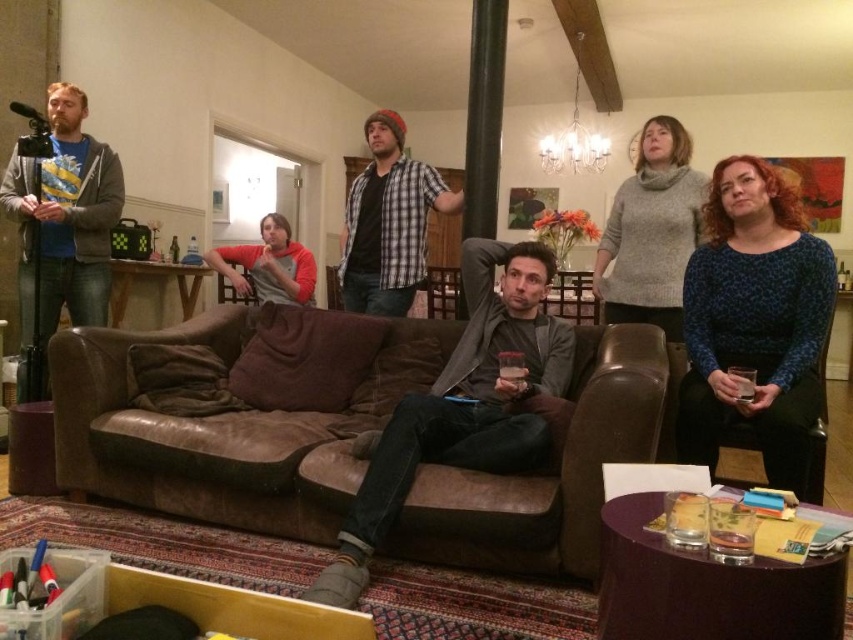
Question: Is brown leather couch at center to the left of matte gray hoodie at left from the viewer's perspective?

Choices:
 (A) no
 (B) yes

Answer: (A)

Question: Based on their relative distances, which object is farther from the matte gray hoodie at left?

Choices:
 (A) knitted gray sweater at upper right
 (B) black fabric armchair at right
 (C) blue dotted sweater at right
 (D) suede couch at center

Answer: (B)

Question: Which object appears closest to the camera in this image?

Choices:
 (A) knitted gray sweater at upper right
 (B) red and gray sweater at center

Answer: (A)

Question: Can you confirm if black fabric armchair at right is positioned to the left of brown leather armchair at center?

Choices:
 (A) yes
 (B) no

Answer: (B)

Question: Does brown leather couch at center appear on the left side of red and gray sweater at center?

Choices:
 (A) no
 (B) yes

Answer: (A)

Question: Which point is closer to the camera taking this photo?

Choices:
 (A) (257, 300)
 (B) (399, 244)
 (C) (461, 378)

Answer: (C)